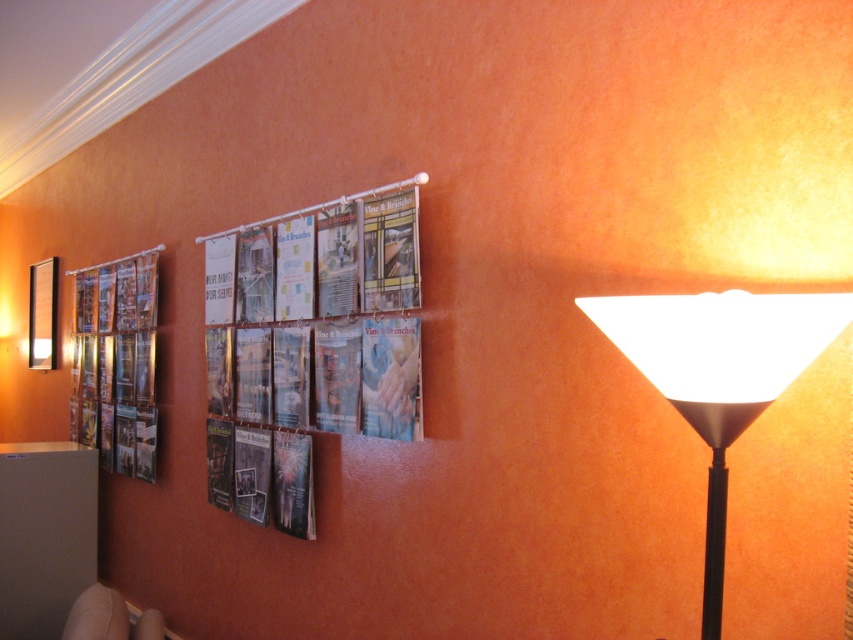
Question: Which point appears farthest from the camera in this image?

Choices:
 (A) (294, 477)
 (B) (97, 387)
 (C) (51, 307)
 (D) (109, 602)

Answer: (C)

Question: In this image, where is metallic glossy poster at left located relative to white fabric couch at lower left?

Choices:
 (A) left
 (B) right

Answer: (A)

Question: Can you confirm if matte paper magazine at center is thinner than white matte floor lamp at right?

Choices:
 (A) no
 (B) yes

Answer: (A)

Question: Among these points, which one is nearest to the camera?

Choices:
 (A) (86, 588)
 (B) (45, 312)
 (C) (323, 348)

Answer: (C)

Question: Which object is the farthest from the matte black picture frame at left?

Choices:
 (A) metallic glossy poster at left
 (B) white matte floor lamp at right
 (C) white fabric couch at lower left

Answer: (B)

Question: Observing the image, what is the correct spatial positioning of white fabric couch at lower left in reference to matte black picture frame at left?

Choices:
 (A) right
 (B) left

Answer: (A)